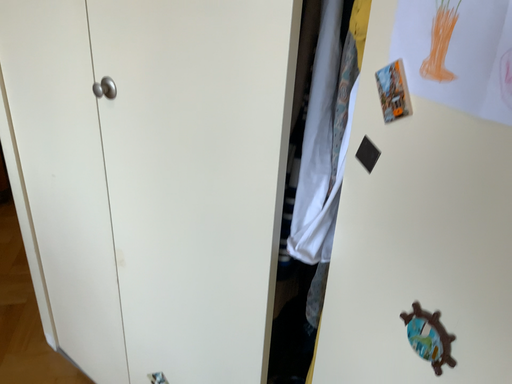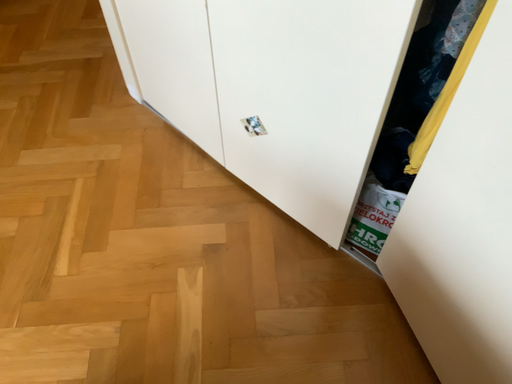
Question: How did the camera likely rotate when shooting the video?

Choices:
 (A) rotated upward
 (B) rotated downward

Answer: (B)